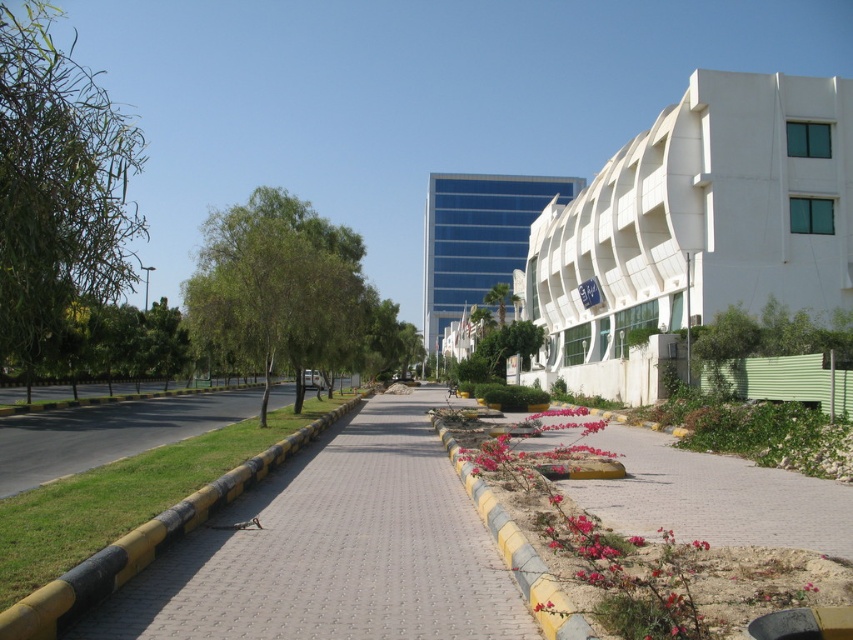
You are a city planner assessing the urban layout. You need to determine if the blue glass building at center can be seen from the yellow rubber curb at center without any obstruction. Based on their sizes, can you conclude this?

The blue glass building at center is bigger than the yellow rubber curb at center, so it is likely that the blue glass building at center can be seen from the yellow rubber curb at center without obstruction.

You are standing at the origin point in the image. Which direction should you move to reach the blue glass building at center?

The blue glass building at center is located at coordinates 0.372 in the x and 0.560 in the y. Since the origin is at the bottom left corner, you should move to the right and upwards to reach it.

You are a city planner reviewing the urban layout. You notice the white smooth building at right and the yellow rubber at lower left. Which object is significantly taller?

The white smooth building at right is much taller than the yellow rubber at lower left according to the description.